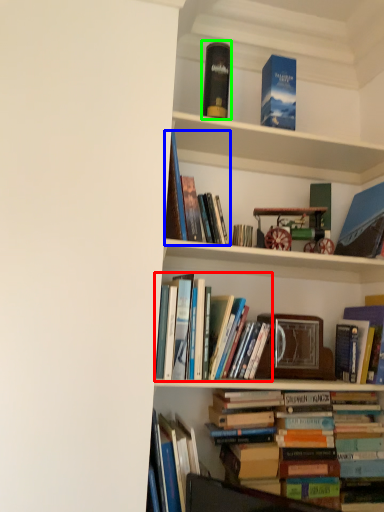
Question: Which is farther away from book (highlighted by a red box)? book (highlighted by a blue box) or paperback book (highlighted by a green box)?

Choices:
 (A) book
 (B) paperback book

Answer: (B)